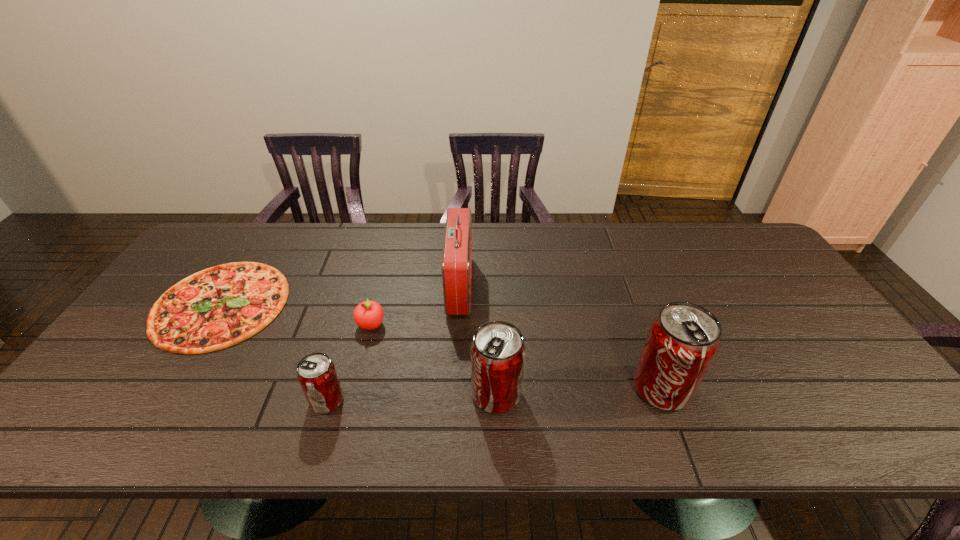
All pop sodas are currently evenly spaced. To continue this pattern, where would you add another pop soda on the right? Please point out a vacant spot. Please provide its 2D coordinates. Your answer should be formatted as a tuple, i.e. [(x, y)], where the tuple contains the x and y coordinates of a point satisfying the conditions above.

[(823, 382)]